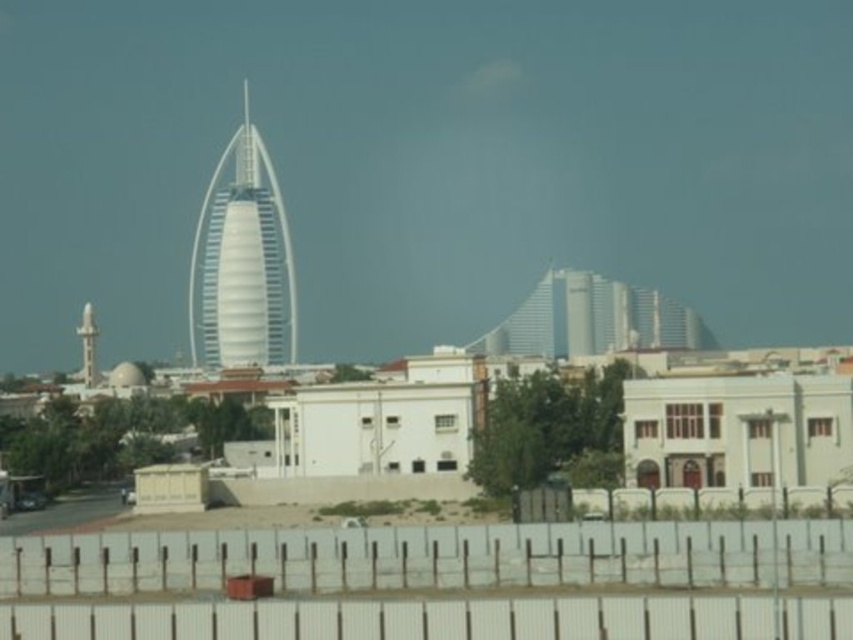
Question: Which point is closer to the camera?

Choices:
 (A) white plastic fence at lower center
 (B) white glossy minaret at upper left
 (C) white smooth tower at center

Answer: (A)

Question: Does white smooth tower at center appear on the left side of white glossy minaret at upper left?

Choices:
 (A) yes
 (B) no

Answer: (B)

Question: Where is white plastic fence at lower center located in relation to white smooth tower at center in the image?

Choices:
 (A) below
 (B) above

Answer: (A)

Question: Does white plastic fence at lower center appear under white smooth tower at center?

Choices:
 (A) yes
 (B) no

Answer: (A)

Question: Which object is closer to the camera taking this photo?

Choices:
 (A) white smooth tower at center
 (B) white plastic fence at lower center

Answer: (B)

Question: Which point is closer to the camera?

Choices:
 (A) (96, 369)
 (B) (380, 564)
 (C) (228, 356)

Answer: (B)